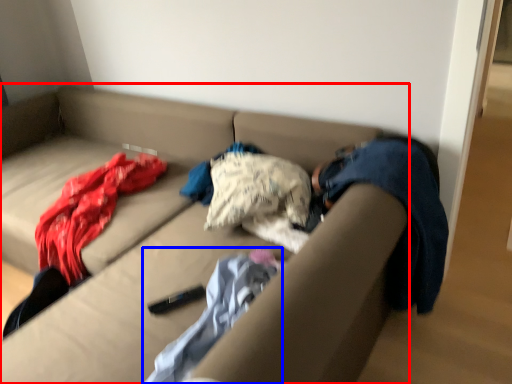
Question: Which of the following is the farthest to the observer, studio couch (highlighted by a red box) or blanket (highlighted by a blue box)?

Choices:
 (A) studio couch
 (B) blanket

Answer: (B)